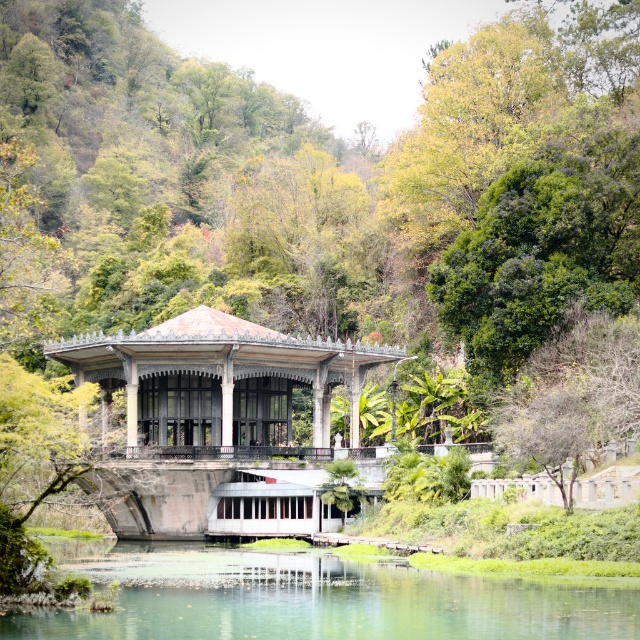
Is clear water at center smaller than matte gray gazebo at center?

Indeed, clear water at center has a smaller size compared to matte gray gazebo at center.

Who is shorter, clear water at center or matte gray gazebo at center?

Standing shorter between the two is clear water at center.

What do you see at coordinates (323, 600) in the screenshot?
I see `clear water at center` at bounding box center [323, 600].

This screenshot has height=640, width=640. In order to click on clear water at center in this screenshot , I will do `click(323, 600)`.